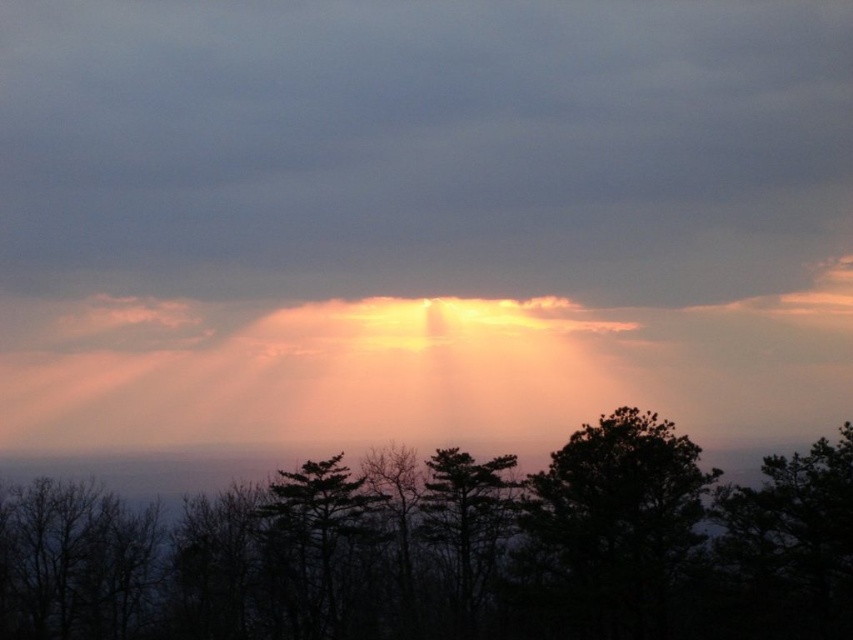
Who is higher up, silhouette tree at center or green matte tree at center?

silhouette tree at center

Is point (625, 534) positioned behind point (337, 531)?

No.

Which is in front, point (131, 637) or point (268, 513)?

Point (268, 513) is in front.

Where is `silhouette tree at center`? The image size is (853, 640). silhouette tree at center is located at coordinates (450, 548).

Is dark green textured tree at center smaller than green matte tree at center?

Yes, dark green textured tree at center is smaller than green matte tree at center.

This screenshot has height=640, width=853. What do you see at coordinates (467, 518) in the screenshot?
I see `dark green textured tree at center` at bounding box center [467, 518].

Locate an element on the screen. dark green textured tree at center is located at coordinates (467, 518).

Measure the distance between silhouette tree at center and dark green textured tree at center.

They are 3.50 meters apart.

Between point (271, 547) and point (426, 528), which one is positioned in front?

Positioned in front is point (271, 547).

Is point (439, 624) in front of point (498, 468)?

Yes, point (439, 624) is closer to viewer.

This screenshot has height=640, width=853. In order to click on silhouette tree at center in this screenshot , I will do `click(450, 548)`.